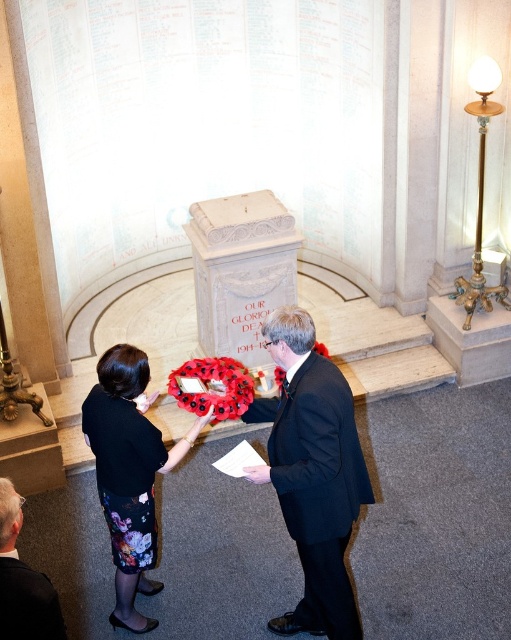
Question: Which object appears farthest from the camera in this image?

Choices:
 (A) floral skirt at center
 (B) dark suit at lower left
 (C) black suit at center

Answer: (A)

Question: Which object is positioned closest to the dark suit at lower left?

Choices:
 (A) black suit at center
 (B) floral skirt at center

Answer: (B)

Question: Considering the relative positions of floral skirt at center and dark suit at lower left in the image provided, where is floral skirt at center located with respect to dark suit at lower left?

Choices:
 (A) below
 (B) above

Answer: (B)

Question: Does black suit at center have a smaller size compared to floral skirt at center?

Choices:
 (A) no
 (B) yes

Answer: (A)

Question: In this image, where is black suit at center located relative to floral skirt at center?

Choices:
 (A) above
 (B) below

Answer: (A)

Question: Estimate the real-world distances between objects in this image. Which object is farther from the floral skirt at center?

Choices:
 (A) dark suit at lower left
 (B) black suit at center

Answer: (A)